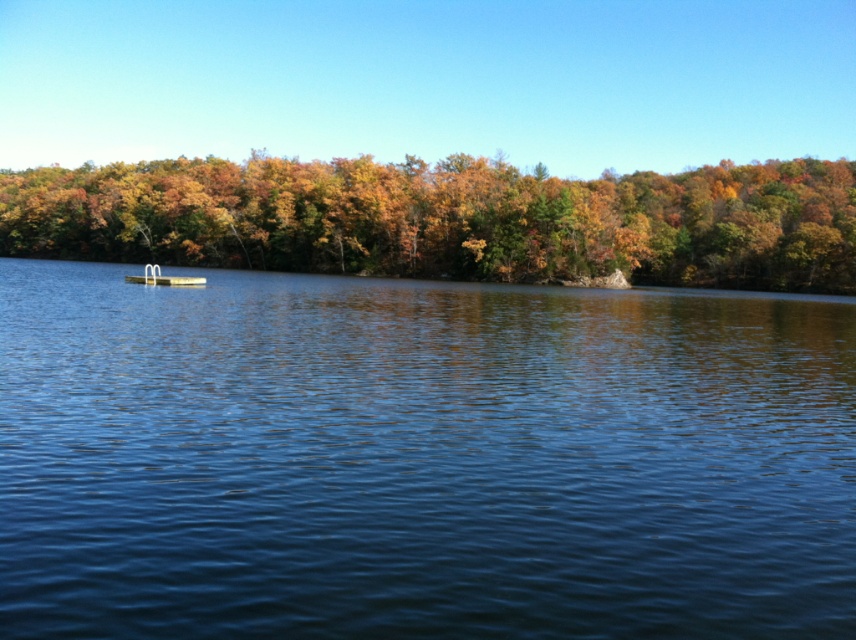
Question: Among these objects, which one is nearest to the camera?

Choices:
 (A) white plastic boat at center
 (B) blue water at center

Answer: (B)

Question: Is blue water at center above white plastic boat at center?

Choices:
 (A) no
 (B) yes

Answer: (A)

Question: Which is nearer to the blue water at center?

Choices:
 (A) green matte tree at upper center
 (B) white plastic boat at center

Answer: (B)

Question: Observing the image, what is the correct spatial positioning of green matte tree at upper center in reference to white plastic boat at center?

Choices:
 (A) right
 (B) left

Answer: (B)

Question: Which point is farther to the camera?

Choices:
 (A) green matte tree at upper center
 (B) blue water at center

Answer: (A)

Question: Is blue water at center above white plastic boat at center?

Choices:
 (A) yes
 (B) no

Answer: (B)